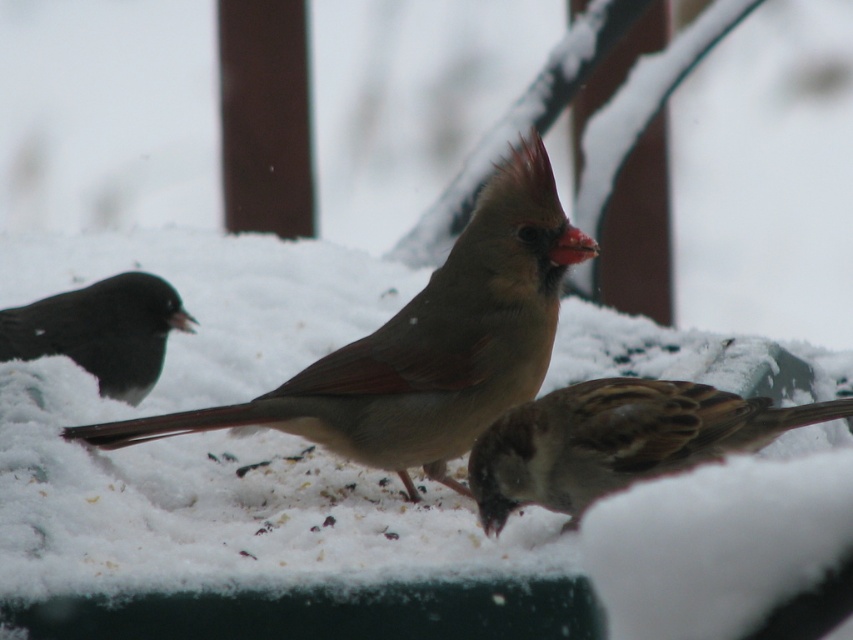
Is point (357, 429) farther from camera compared to point (490, 493)?

That is True.

Is point (515, 202) in front of point (698, 444)?

No, (515, 202) is further to viewer.

The image size is (853, 640). I want to click on brown speckled sparrow at center, so click(x=425, y=346).

Who is more distant from viewer, (492, 400) or (158, 374)?

The point (158, 374) is behind.

Does brown speckled sparrow at center have a lesser height compared to black matte bird at left?

In fact, brown speckled sparrow at center may be taller than black matte bird at left.

Between point (526, 342) and point (85, 317), which one is positioned behind?

The point (85, 317) is more distant.

Where is `brown speckled sparrow at center`? brown speckled sparrow at center is located at coordinates (425, 346).

Can you confirm if brown speckled sparrow at lower right is positioned below black matte bird at left?

Correct, brown speckled sparrow at lower right is located below black matte bird at left.

Is point (555, 472) farther from viewer compared to point (186, 312)?

No, (555, 472) is in front of (186, 312).

Describe the element at coordinates (618, 440) in the screenshot. I see `brown speckled sparrow at lower right` at that location.

I want to click on brown speckled sparrow at lower right, so click(618, 440).